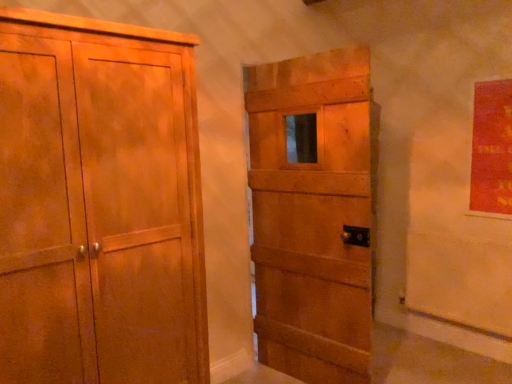
Question: Is matte wooden door at center surrounding matte wood cupboard at left?

Choices:
 (A) yes
 (B) no

Answer: (B)

Question: Is matte wooden door at center shorter than matte wood cupboard at left?

Choices:
 (A) no
 (B) yes

Answer: (A)

Question: Does matte wooden door at center have a smaller size compared to matte wood cupboard at left?

Choices:
 (A) yes
 (B) no

Answer: (A)

Question: Is matte wooden door at center facing towards matte wood cupboard at left?

Choices:
 (A) yes
 (B) no

Answer: (A)

Question: Can you confirm if matte wooden door at center is thinner than matte wood cupboard at left?

Choices:
 (A) no
 (B) yes

Answer: (B)

Question: From the image's perspective, would you say matte wooden door at center is shown under matte wood cupboard at left?

Choices:
 (A) yes
 (B) no

Answer: (B)

Question: Does matte wood cupboard at left come behind matte wooden door at center?

Choices:
 (A) no
 (B) yes

Answer: (A)

Question: Considering the relative sizes of matte wood cupboard at left and matte wooden door at center in the image provided, is matte wood cupboard at left wider than matte wooden door at center?

Choices:
 (A) no
 (B) yes

Answer: (B)

Question: Is matte wood cupboard at left next to matte wooden door at center and touching it?

Choices:
 (A) no
 (B) yes

Answer: (A)

Question: From the image's perspective, is matte wood cupboard at left beneath matte wooden door at center?

Choices:
 (A) no
 (B) yes

Answer: (B)

Question: Is matte wood cupboard at left not within matte wooden door at center?

Choices:
 (A) yes
 (B) no

Answer: (A)

Question: Is matte wood cupboard at left taller than matte wooden door at center?

Choices:
 (A) no
 (B) yes

Answer: (A)

Question: From the image's perspective, is matte wood cupboard at left located above or below matte wooden door at center?

Choices:
 (A) above
 (B) below

Answer: (B)